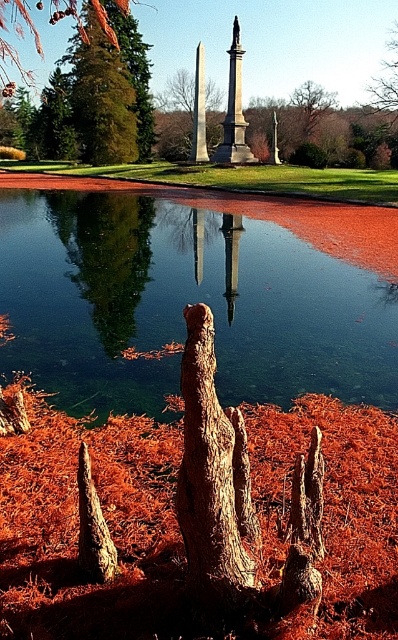
In the serene park scene, there is a reflective pond and a point marked at coordinates (128, 60). What object is located at this point?

The point at coordinates (128, 60) marks the green textured tree at upper left.

In the scene shown: You are standing at the point with coordinates point (105, 38) and want to walk to the point with coordinates point (243, 154). Which direction should you move to get closer to your destination?

To move closer to point (243, 154) from point (105, 38), you should move forward since point (105, 38) is behind point (243, 154).

You are standing in the park and want to take a photo of both the point at coordinates (247, 566) and the point at coordinates (394, 116). Which point should you focus on first to ensure both are in sharp focus?

You should focus on the point at coordinates (247, 566) first because it is closer to the camera. Since it is closer, focusing on it will help ensure both points are within the depth of field and in sharp focus.